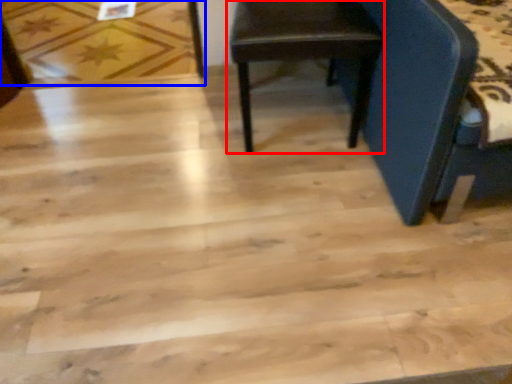
Question: Which object is further to the camera taking this photo, chair (highlighted by a red box) or plywood (highlighted by a blue box)?

Choices:
 (A) chair
 (B) plywood

Answer: (B)